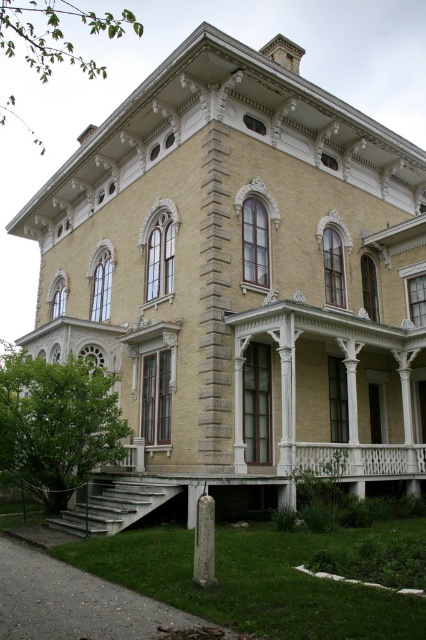
Between point (336, 476) and point (212, 560), which one is positioned in front?

Positioned in front is point (212, 560).

Does point (374, 460) lie behind point (198, 512)?

Yes, it is behind point (198, 512).

I want to click on white painted wood porch at lower center, so click(160, 497).

The image size is (426, 640). Describe the element at coordinates (160, 497) in the screenshot. I see `white painted wood porch at lower center` at that location.

I want to click on white painted wood porch at lower center, so click(x=160, y=497).

Is white wood balustrade at center to the left of white stone post at lower center from the viewer's perspective?

No, white wood balustrade at center is not to the left of white stone post at lower center.

Which is behind, point (313, 460) or point (209, 561)?

Positioned behind is point (313, 460).

Locate an element on the screen. The width and height of the screenshot is (426, 640). white wood balustrade at center is located at coordinates (359, 460).